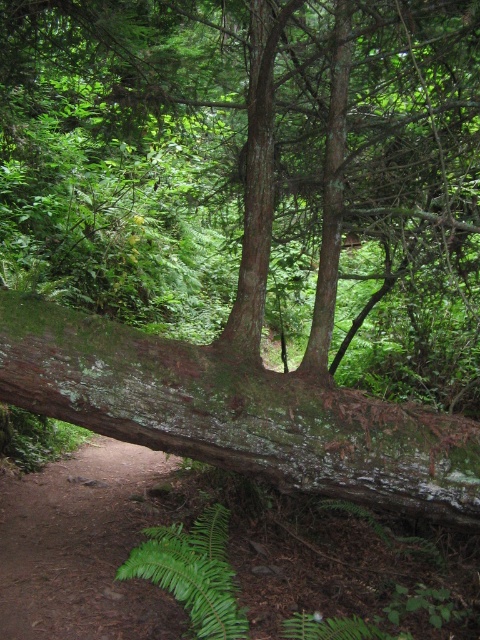
Can you confirm if green mossy log at center is positioned to the right of green leafy fern at lower center?

Indeed, green mossy log at center is positioned on the right side of green leafy fern at lower center.

Image resolution: width=480 pixels, height=640 pixels. Identify the location of green mossy log at center. (237, 412).

Find the location of a particular element. green mossy log at center is located at coordinates (237, 412).